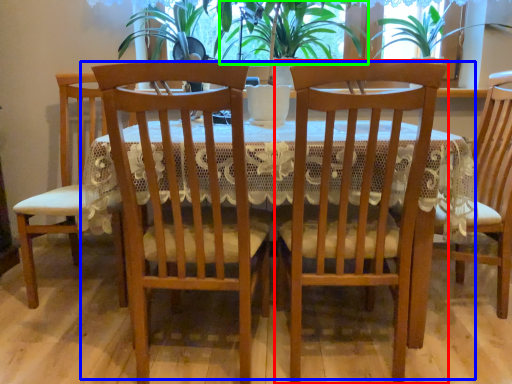
Question: Which object is positioned closest to chair (highlighted by a red box)? Select from kitchen & dining room table (highlighted by a blue box) and plant (highlighted by a green box).

Choices:
 (A) kitchen & dining room table
 (B) plant

Answer: (A)